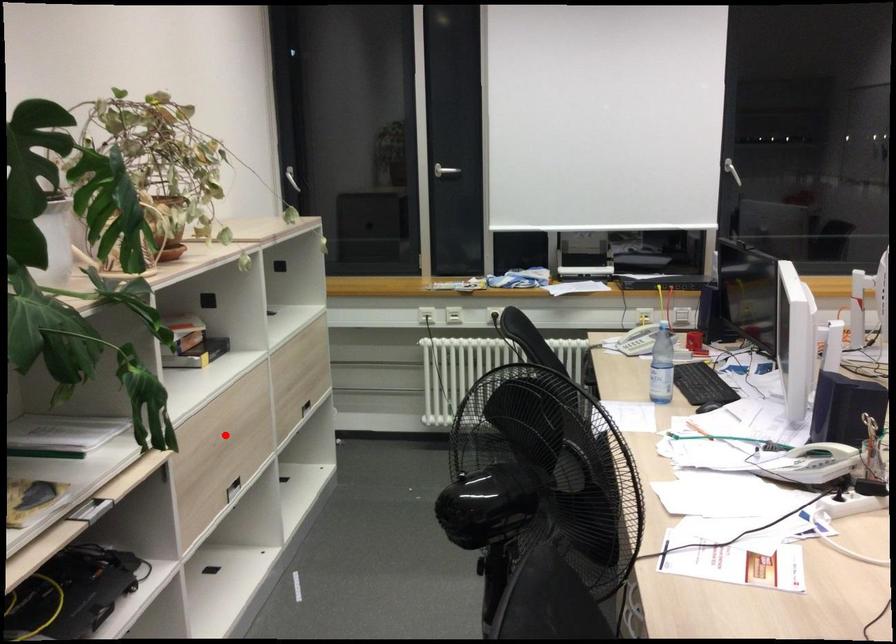
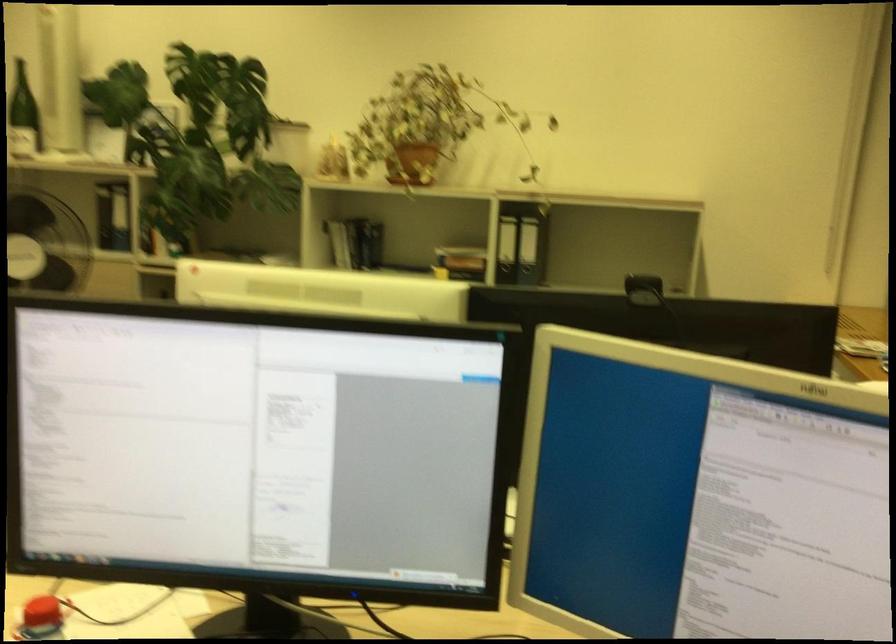
Question: I am providing you with two images of the same scene from different viewpoints. A red point is marked on the first image. Can you still see the location of the red point in image 2?

Choices:
 (A) Yes
 (B) No

Answer: (B)